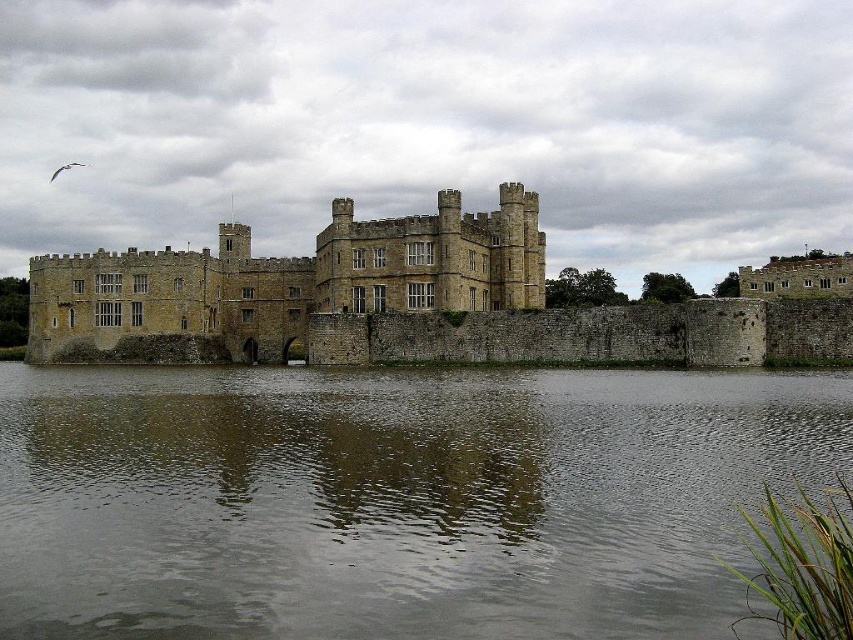
Question: Is gray reflective water at center above stone castle at center?

Choices:
 (A) no
 (B) yes

Answer: (A)

Question: Among these objects, which one is farthest from the camera?

Choices:
 (A) brown stone castle at upper right
 (B) gray reflective water at center

Answer: (A)

Question: Is gray reflective water at center further to the viewer compared to stone castle at center?

Choices:
 (A) yes
 (B) no

Answer: (B)

Question: Is gray reflective water at center thinner than brown stone castle at upper right?

Choices:
 (A) yes
 (B) no

Answer: (B)

Question: Which object appears closest to the camera in this image?

Choices:
 (A) brown stone castle at upper right
 (B) gray reflective water at center

Answer: (B)

Question: Which of the following is the closest to the observer?

Choices:
 (A) stone castle at center
 (B) brown stone castle at upper right

Answer: (A)